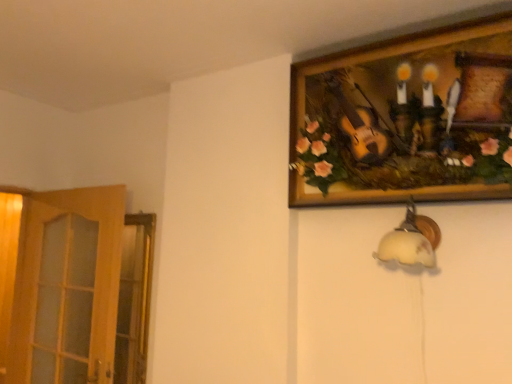
Question: Considering the relative sizes of white frosted glass lampshade at lower right and wooden picture frame at upper right in the image provided, is white frosted glass lampshade at lower right thinner than wooden picture frame at upper right?

Choices:
 (A) yes
 (B) no

Answer: (B)

Question: Is white frosted glass lampshade at lower right further to camera compared to wooden picture frame at upper right?

Choices:
 (A) no
 (B) yes

Answer: (B)

Question: Is white frosted glass lampshade at lower right touching wooden picture frame at upper right?

Choices:
 (A) no
 (B) yes

Answer: (A)

Question: Would you say white frosted glass lampshade at lower right is a long distance from wooden picture frame at upper right?

Choices:
 (A) no
 (B) yes

Answer: (A)

Question: From the image's perspective, is white frosted glass lampshade at lower right over wooden picture frame at upper right?

Choices:
 (A) yes
 (B) no

Answer: (B)

Question: Is wooden picture frame at upper right to the left or to the right of white frosted glass lampshade at lower right in the image?

Choices:
 (A) right
 (B) left

Answer: (B)

Question: Looking at the image, does wooden picture frame at upper right seem bigger or smaller compared to white frosted glass lampshade at lower right?

Choices:
 (A) small
 (B) big

Answer: (B)

Question: From a real-world perspective, is wooden picture frame at upper right positioned above or below white frosted glass lampshade at lower right?

Choices:
 (A) above
 (B) below

Answer: (A)

Question: From the image's perspective, is wooden picture frame at upper right positioned above or below white frosted glass lampshade at lower right?

Choices:
 (A) below
 (B) above

Answer: (B)

Question: Based on their sizes in the image, would you say wooden picture frame at upper right is bigger or smaller than wooden at left?

Choices:
 (A) small
 (B) big

Answer: (A)

Question: Based on their positions, is wooden picture frame at upper right located to the left or right of wooden at left?

Choices:
 (A) left
 (B) right

Answer: (B)

Question: Does point (377, 112) appear closer or farther from the camera than point (34, 311)?

Choices:
 (A) farther
 (B) closer

Answer: (B)

Question: In terms of width, does wooden picture frame at upper right look wider or thinner when compared to wooden at left?

Choices:
 (A) thin
 (B) wide

Answer: (B)

Question: Is white frosted glass lampshade at lower right taller or shorter than wooden at left?

Choices:
 (A) short
 (B) tall

Answer: (A)

Question: From a real-world perspective, is white frosted glass lampshade at lower right positioned above or below wooden at left?

Choices:
 (A) below
 (B) above

Answer: (B)